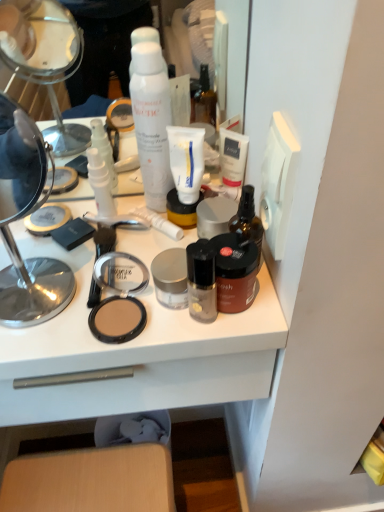
This screenshot has width=384, height=512. What do you see at coordinates (23, 216) in the screenshot?
I see `metallic silver magnifying glass at left` at bounding box center [23, 216].

Describe the element at coordinates (100, 183) in the screenshot. I see `transparent plastic bottles at center, positioned as the first toiletry in left-to-right order` at that location.

At what (x,y) coordinates should I click in order to perform the action: click on brown matte jar at center, which ranks as the 5th toiletry in left-to-right order. Please return your answer as a coordinate pair (x, y). This screenshot has height=512, width=384. Looking at the image, I should click on click(235, 271).

What is the approximate height of brown matte bottle at right?

It is 5.51 inches.

What do you see at coordinates (248, 220) in the screenshot? I see `brown matte bottle at right` at bounding box center [248, 220].

Measure the distance between point (120, 307) and camera.

The depth of point (120, 307) is 21.69 inches.

Measure the distance between matte brown compact at center and camera.

The depth of matte brown compact at center is 51.76 centimeters.

The image size is (384, 512). Identify the location of metallic silver magnifying glass at left. (23, 216).

Consider the image. Which point is more distant from viewer, (x=215, y=298) or (x=97, y=168)?

Positioned behind is point (x=97, y=168).

Which is more to the left, satin black foundation at center, the fourth toiletry from the left, or transparent plastic bottles at center, which is counted as the 5th toiletry, starting from the right?

From the viewer's perspective, transparent plastic bottles at center, which is counted as the 5th toiletry, starting from the right, appears more on the left side.

From a real-world perspective, is satin black foundation at center, the fourth toiletry from the left, beneath transparent plastic bottles at center, which is counted as the 5th toiletry, starting from the right?

Yes, from a real-world perspective, satin black foundation at center, the fourth toiletry from the left, is under transparent plastic bottles at center, which is counted as the 5th toiletry, starting from the right.

From the picture: Considering the sizes of satin black foundation at center, placed as the 2th toiletry when sorted from right to left, and transparent plastic bottles at center, which is counted as the 5th toiletry, starting from the right, in the image, is satin black foundation at center, placed as the 2th toiletry when sorted from right to left, wider or thinner than transparent plastic bottles at center, which is counted as the 5th toiletry, starting from the right,?

In the image, satin black foundation at center, placed as the 2th toiletry when sorted from right to left, appears to be wider than transparent plastic bottles at center, which is counted as the 5th toiletry, starting from the right.

Is brown matte jar at center, which ranks as the 5th toiletry in left-to-right order, to the left of metallic silver magnifying glass at left from the viewer's perspective?

In fact, brown matte jar at center, which ranks as the 5th toiletry in left-to-right order, is to the right of metallic silver magnifying glass at left.

From the image's perspective, which is below, brown matte jar at center, which ranks as the 5th toiletry in left-to-right order, or metallic silver magnifying glass at left?

brown matte jar at center, which ranks as the 5th toiletry in left-to-right order, is shown below in the image.

Is brown matte jar at center, which ranks as the 5th toiletry in left-to-right order, behind metallic silver magnifying glass at left?

Yes.

What's the angular difference between brown matte jar at center, which ranks as the first toiletry in right-to-left order, and metallic silver magnifying glass at left's facing directions?

There is a 0.000775-degree angle between the facing directions of brown matte jar at center, which ranks as the first toiletry in right-to-left order, and metallic silver magnifying glass at left.

Is satin silver jar at center, the 3th toiletry viewed from the right, at the right side of brown matte bottle at right?

No, satin silver jar at center, the 3th toiletry viewed from the right, is not to the right of brown matte bottle at right.

Which object is thinner, satin silver jar at center, the 3th toiletry viewed from the right, or brown matte bottle at right?

Thinner between the two is brown matte bottle at right.

Is satin silver jar at center, the 3th toiletry viewed from the right, surrounding brown matte bottle at right?

No, brown matte bottle at right is not surrounded by satin silver jar at center, the 3th toiletry viewed from the right.

Which is further, (164, 224) or (253, 196)?

Positioned behind is point (164, 224).

From the image's perspective, is white plastic tube at center, the fourth toiletry positioned from the right, located beneath brown matte bottle at right?

Incorrect, from the image's perspective, white plastic tube at center, the fourth toiletry positioned from the right, is higher than brown matte bottle at right.

Considering the sizes of objects white plastic tube at center, the fourth toiletry positioned from the right, and brown matte bottle at right in the image provided, who is shorter, white plastic tube at center, the fourth toiletry positioned from the right, or brown matte bottle at right?

With less height is white plastic tube at center, the fourth toiletry positioned from the right.

Consider the image. How much distance is there between white plastic tube at center, which appears as the second toiletry when viewed from the left, and brown matte bottle at right?

white plastic tube at center, which appears as the second toiletry when viewed from the left, is 4.86 inches from brown matte bottle at right.

Does white plastic tube at center, the fourth toiletry positioned from the right, turn towards white matte shaving cream at center?

No, white plastic tube at center, the fourth toiletry positioned from the right, is not oriented towards white matte shaving cream at center.

Can you see white plastic tube at center, which appears as the second toiletry when viewed from the left, touching white matte shaving cream at center?

No, white plastic tube at center, which appears as the second toiletry when viewed from the left, is not making contact with white matte shaving cream at center.

Considering the relative sizes of white plastic tube at center, the fourth toiletry positioned from the right, and white matte shaving cream at center in the image provided, is white plastic tube at center, the fourth toiletry positioned from the right, thinner than white matte shaving cream at center?

In fact, white plastic tube at center, the fourth toiletry positioned from the right, might be wider than white matte shaving cream at center.

Consider the image. Considering the sizes of objects white plastic tube at center, the fourth toiletry positioned from the right, and white matte shaving cream at center in the image provided, who is taller, white plastic tube at center, the fourth toiletry positioned from the right, or white matte shaving cream at center?

white matte shaving cream at center.

Based on the photo, from a real-world perspective, is brown matte bottle at right located beneath white matte shaving cream at center?

Yes, from a real-world perspective, brown matte bottle at right is under white matte shaving cream at center.

Consider the image. Looking at their sizes, would you say brown matte bottle at right is wider or thinner than white matte shaving cream at center?

In the image, brown matte bottle at right appears to be more narrow than white matte shaving cream at center.

Are brown matte bottle at right and white matte shaving cream at center far apart?

No, there isn't a large distance between brown matte bottle at right and white matte shaving cream at center.

Considering the relative sizes of brown matte bottle at right and white matte shaving cream at center in the image provided, is brown matte bottle at right taller than white matte shaving cream at center?

In fact, brown matte bottle at right may be shorter than white matte shaving cream at center.

Based on the photo, does satin silver jar at center, the 3th toiletry viewed from the right, appear on the left side of white plastic tube at center, which appears as the second toiletry when viewed from the left?

In fact, satin silver jar at center, the 3th toiletry viewed from the right, is to the right of white plastic tube at center, which appears as the second toiletry when viewed from the left.

At what (x,y) coordinates should I click in order to perform the action: click on the 2nd toiletry above when counting from the satin silver jar at center, which is counted as the third toiletry, starting from the left (from the image's perspective). Please return your answer as a coordinate pair (x, y). Looking at the image, I should click on (159, 222).

Can you see satin silver jar at center, which is counted as the third toiletry, starting from the left, touching white plastic tube at center, which appears as the second toiletry when viewed from the left?

They are not placed beside each other.

Starting from the satin black foundation at center, the fourth toiletry from the left, which toiletry is the 3rd one to the left? Please provide its 2D coordinates.

[(100, 183)]

Locate an element on the screen. The width and height of the screenshot is (384, 512). magnifying glass that appears above the brown matte jar at center, which ranks as the first toiletry in right-to-left order (from a real-world perspective) is located at coordinates (23, 216).

Estimate the real-world distances between objects in this image. Which object is closer to satin silver jar at center, the 3th toiletry viewed from the right, satin black foundation at center, the fourth toiletry from the left, or metallic silver magnifying glass at left?

Among the two, satin black foundation at center, the fourth toiletry from the left, is located nearer to satin silver jar at center, the 3th toiletry viewed from the right.

From the image, which object appears to be nearer to satin black foundation at center, placed as the 2th toiletry when sorted from right to left, satin silver jar at center, the 3th toiletry viewed from the right, or transparent plastic bottles at center, positioned as the first toiletry in left-to-right order?

The object closer to satin black foundation at center, placed as the 2th toiletry when sorted from right to left, is satin silver jar at center, the 3th toiletry viewed from the right.

Which object lies nearer to the anchor point satin black foundation at center, the fourth toiletry from the left, matte plastic makeup at center or white plastic tube at center, the fourth toiletry positioned from the right?

matte plastic makeup at center is positioned closer to the anchor satin black foundation at center, the fourth toiletry from the left.

From the image, which object appears to be nearer to matte brown compact at center, white matte shaving cream at center or white matte tube at center?

white matte tube at center lies closer to matte brown compact at center than the other object.

From the image, which object appears to be nearer to matte brown compact at center, metallic silver magnifying glass at left or white matte tube at center?

white matte tube at center is closer to matte brown compact at center.

Estimate the real-world distances between objects in this image. Which object is further from white plastic tube at center, which appears as the second toiletry when viewed from the left, brown matte jar at center, which ranks as the first toiletry in right-to-left order, or matte brown compact at center?

The object further to white plastic tube at center, which appears as the second toiletry when viewed from the left, is brown matte jar at center, which ranks as the first toiletry in right-to-left order.

When comparing their distances from transparent plastic bottles at center, which is counted as the 5th toiletry, starting from the right, does white matte tube at center or satin black foundation at center, placed as the 2th toiletry when sorted from right to left, seem further?

satin black foundation at center, placed as the 2th toiletry when sorted from right to left, is further to transparent plastic bottles at center, which is counted as the 5th toiletry, starting from the right.

From the image, which object appears to be nearer to brown matte jar at center, which ranks as the 5th toiletry in left-to-right order, brown matte bottle at right or satin black foundation at center, placed as the 2th toiletry when sorted from right to left?

satin black foundation at center, placed as the 2th toiletry when sorted from right to left, is positioned closer to the anchor brown matte jar at center, which ranks as the 5th toiletry in left-to-right order.

Find the location of a particular element. The image size is (384, 512). desk between satin black foundation at center, placed as the 2th toiletry when sorted from right to left, and white plastic tube at center, the fourth toiletry positioned from the right, along the z-axis is located at coordinates (132, 355).

You are a GUI agent. You are given a task and a screenshot of the screen. Output one action in this format:
    pyautogui.click(x=<x>, y=<y>)
    Task: Click on the face powder between brown matte jar at center, which ranks as the 5th toiletry in left-to-right order, and white plastic tube at center, which appears as the second toiletry when viewed from the left, in the front-back direction
    The width and height of the screenshot is (384, 512).
    Given the screenshot: What is the action you would take?
    pyautogui.click(x=117, y=319)

This screenshot has height=512, width=384. Identify the location of bottle between satin black foundation at center, placed as the 2th toiletry when sorted from right to left, and white plastic tube at center, which appears as the second toiletry when viewed from the left, from front to back. (248, 220).

This screenshot has width=384, height=512. I want to click on toothpaste between metallic silver magnifying glass at left and satin black foundation at center, placed as the 2th toiletry when sorted from right to left, so click(x=186, y=161).